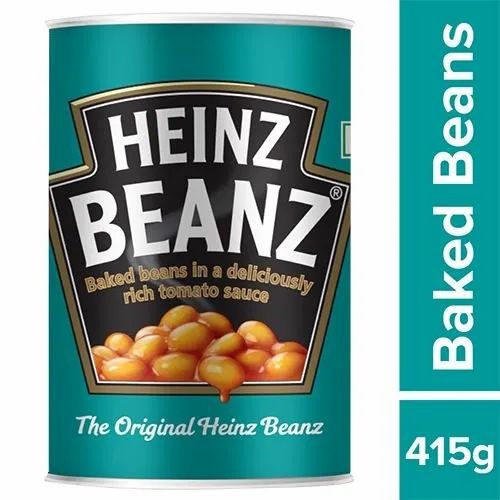
Find the location of `gold border`. gold border is located at coordinates (314, 137).